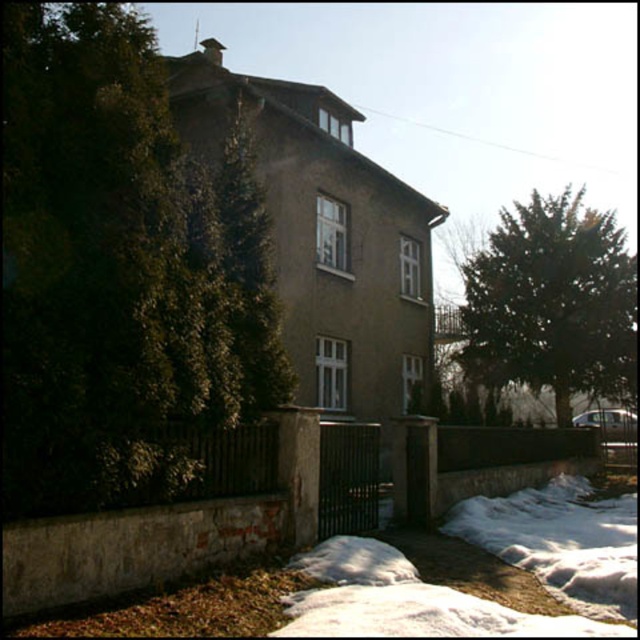
Who is positioned more to the left, green leafy tree at left or white fluffy snow at lower center?

green leafy tree at left

In order to click on green leafy tree at left in this screenshot , I will do `click(125, 278)`.

Can you confirm if white fluffy snow at lower center is thinner than dark green textured tree at right?

Yes, white fluffy snow at lower center is thinner than dark green textured tree at right.

Between point (371, 625) and point (625, 288), which one is positioned in front?

Point (371, 625) is more forward.

At what (x,y) coordinates should I click in order to perform the action: click on white fluffy snow at lower center. Please return your answer as a coordinate pair (x, y). The height and width of the screenshot is (640, 640). Looking at the image, I should click on (508, 563).

Is point (45, 209) positioned after point (608, 387)?

No, it is not.

Does green leafy tree at left have a lesser height compared to dark green textured tree at right?

Correct, green leafy tree at left is not as tall as dark green textured tree at right.

Is point (145, 67) closer to camera compared to point (548, 376)?

Yes, point (145, 67) is closer to viewer.

Image resolution: width=640 pixels, height=640 pixels. Find the location of `green leafy tree at left`. green leafy tree at left is located at coordinates (125, 278).